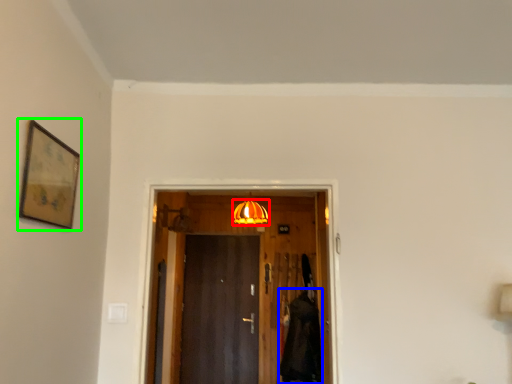
Question: Which object is positioned closest to lamp (highlighted by a red box)? Select from robe (highlighted by a blue box) and picture frame (highlighted by a green box).

Choices:
 (A) robe
 (B) picture frame

Answer: (A)